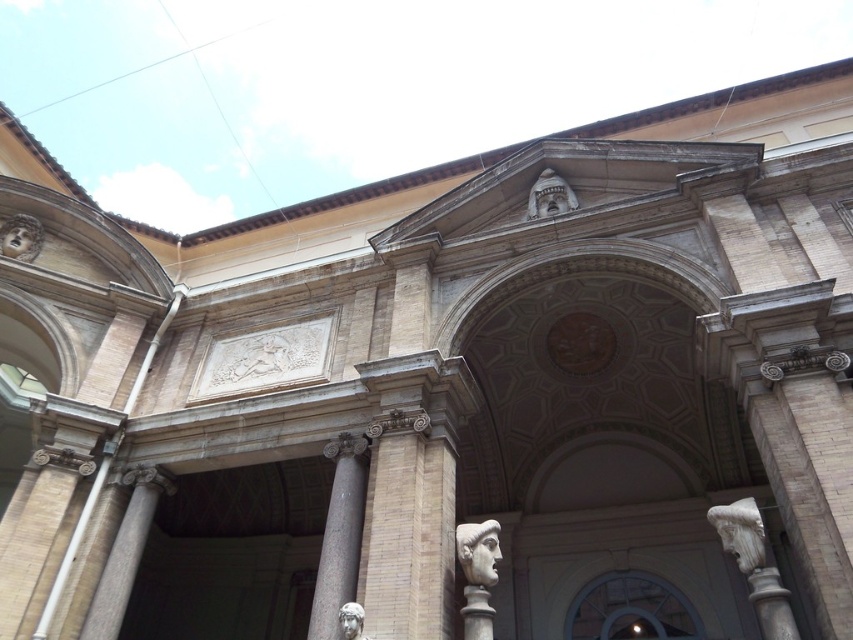
You are an art student analyzing the classical structure. You notice two decorative elements, the white stone bust at upper center and the matte stone mask at upper left. Which of these elements is positioned higher up in the structure?

The white stone bust at upper center is positioned higher up in the structure than the matte stone mask at upper left.

Consider the image. Based on the provided scene description, where exactly is the white marble column at right located?

The white marble column at right is located at point coordinates of (755, 564).